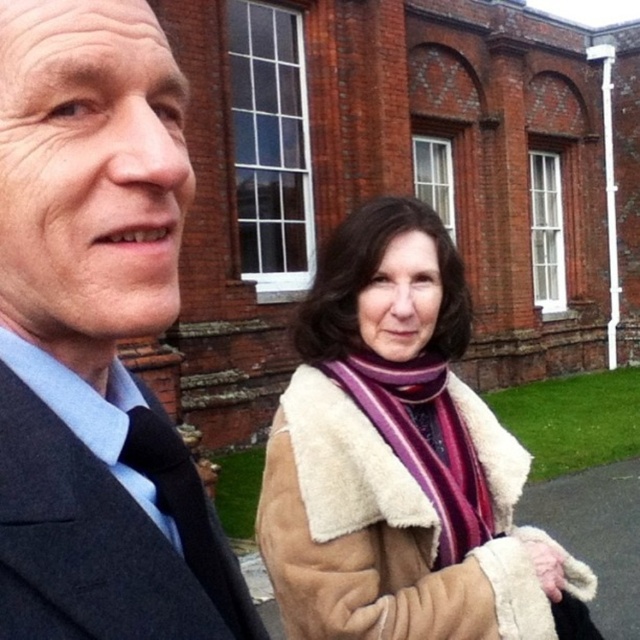
Find the location of `sheepskin coat at center`. sheepskin coat at center is located at coordinates (397, 458).

Is sheepskin coat at center smaller than dark blue woolen suit at left?

Actually, sheepskin coat at center might be larger than dark blue woolen suit at left.

The image size is (640, 640). I want to click on sheepskin coat at center, so click(x=397, y=458).

Does dark gray suit at left have a greater width compared to sheepskin coat at center?

No.

Does dark gray suit at left lie in front of sheepskin coat at center?

Yes, dark gray suit at left is in front of sheepskin coat at center.

Which is behind, point (106, 99) or point (493, 554)?

The point (493, 554) is behind.

The width and height of the screenshot is (640, 640). Find the location of `dark gray suit at left`. dark gray suit at left is located at coordinates (97, 337).

Between dark gray suit at left and dark blue woolen suit at left, which one has more height?

dark blue woolen suit at left

Can you confirm if dark gray suit at left is wider than dark blue woolen suit at left?

No.

Image resolution: width=640 pixels, height=640 pixels. What do you see at coordinates (97, 337) in the screenshot? I see `dark gray suit at left` at bounding box center [97, 337].

Locate an element on the screen. The image size is (640, 640). dark gray suit at left is located at coordinates (97, 337).